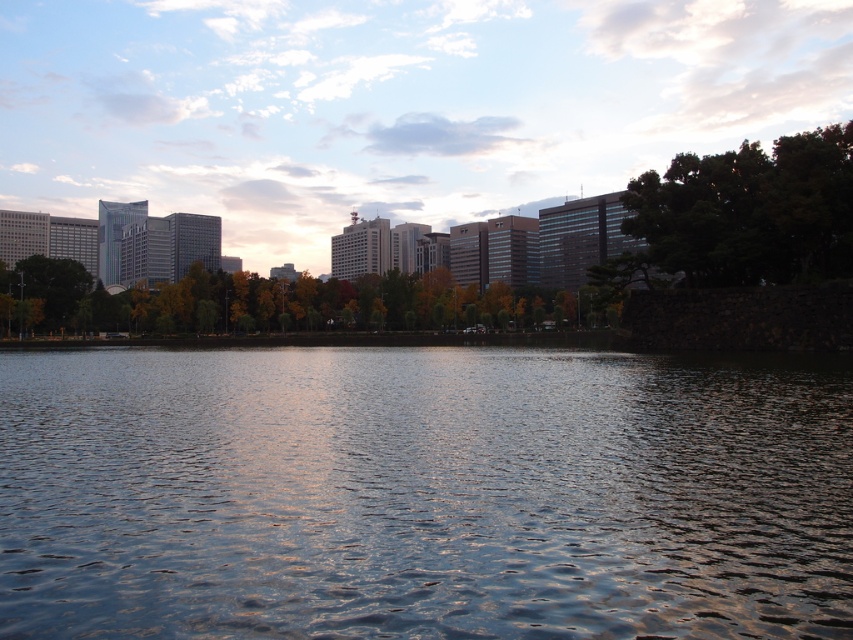
Question: Which of the following is the closest to the observer?

Choices:
 (A) green leafy tree at center
 (B) green leafy tree at upper right

Answer: (B)

Question: Which of the following is the farthest from the observer?

Choices:
 (A) green leafy tree at center
 (B) glistening water at center
 (C) green leafy tree at upper right

Answer: (A)

Question: Estimate the real-world distances between objects in this image. Which object is closer to the green leafy tree at center?

Choices:
 (A) glistening water at center
 (B) green leafy tree at upper right

Answer: (B)

Question: Can you confirm if glistening water at center is wider than green leafy tree at upper right?

Choices:
 (A) yes
 (B) no

Answer: (A)

Question: Does green leafy tree at upper right have a lesser width compared to green leafy tree at center?

Choices:
 (A) yes
 (B) no

Answer: (A)

Question: Does green leafy tree at upper right have a lesser width compared to green leafy tree at center?

Choices:
 (A) yes
 (B) no

Answer: (A)